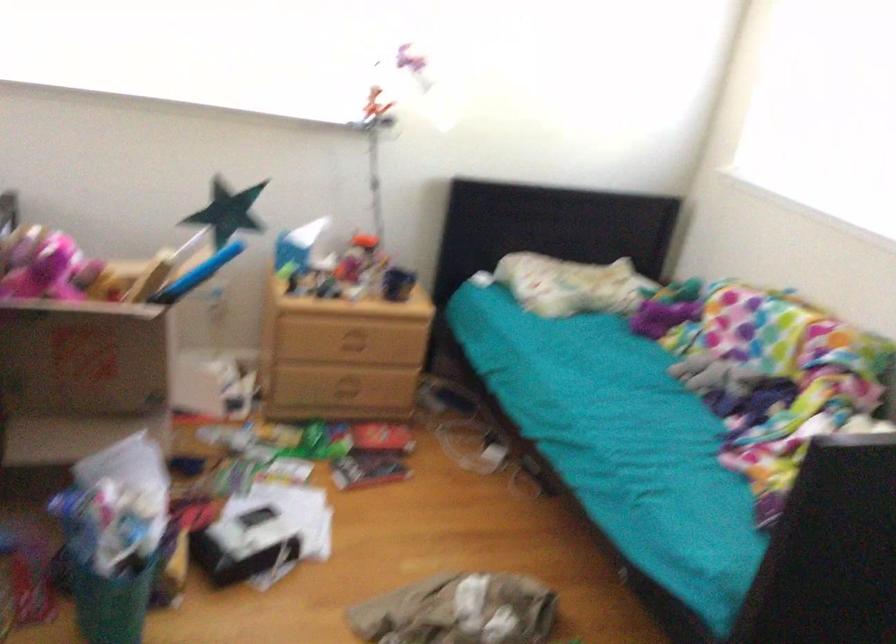
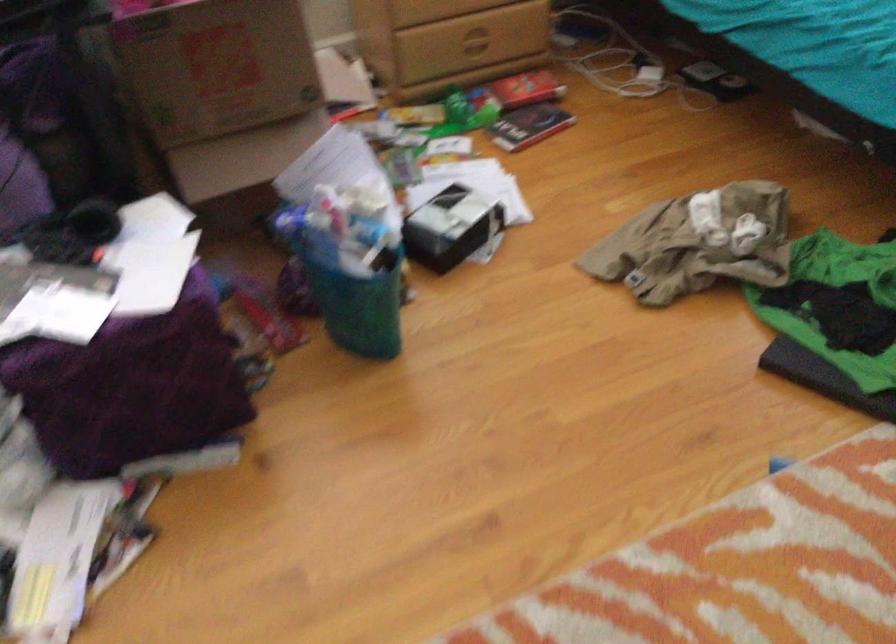
Where in the second image is the point corresponding to point (240, 545) from the first image?

(451, 227)